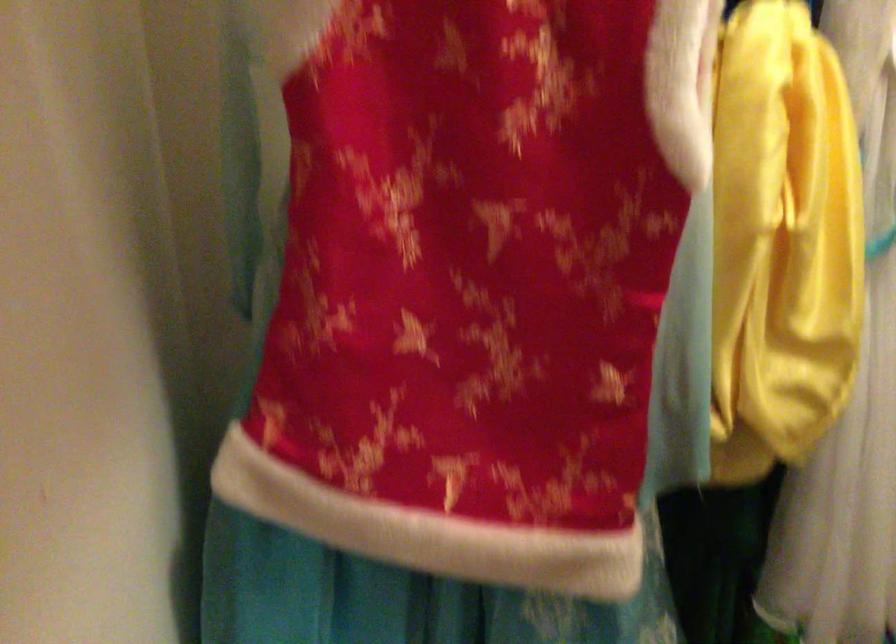
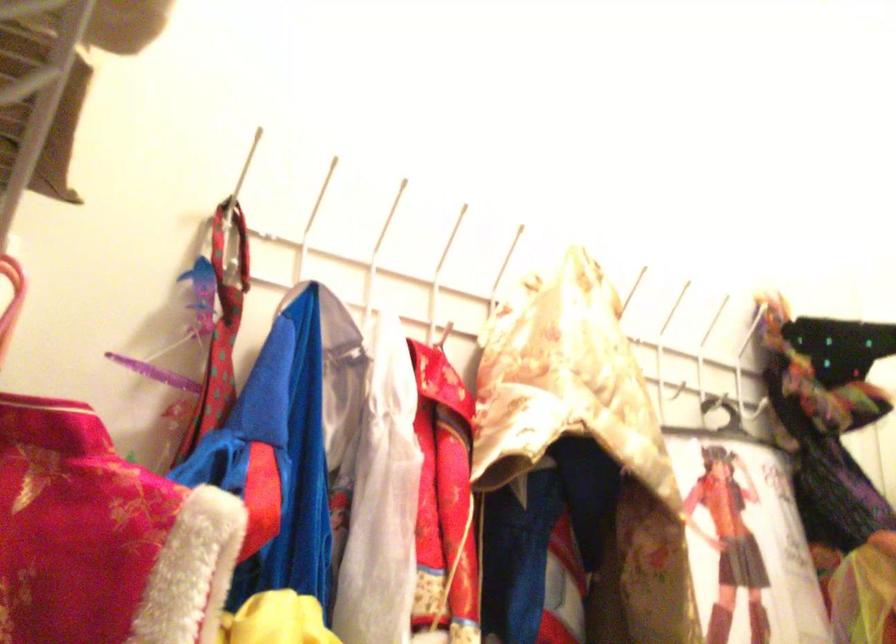
Consider the image. Based on the continuous images, in which direction is the camera rotating?

The camera rotated toward right-up.